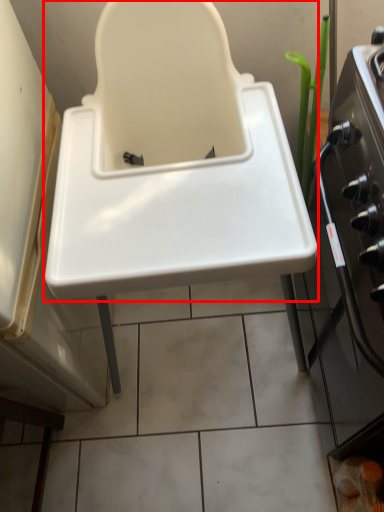
Question: From the image's perspective, considering the relative positions of sink (annotated by the red box) and oven in the image provided, where is sink (annotated by the red box) located with respect to the staircase?

Choices:
 (A) below
 (B) above

Answer: (B)